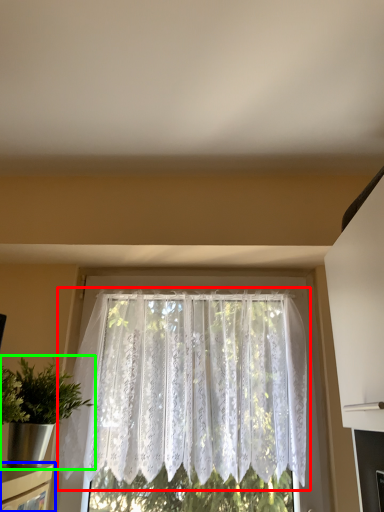
Question: Which object is the farthest from window (highlighted by a red box)? Choose among these: shelf (highlighted by a blue box) or houseplant (highlighted by a green box).

Choices:
 (A) shelf
 (B) houseplant

Answer: (A)